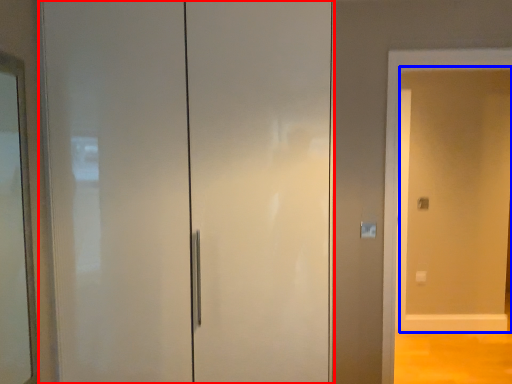
Question: Which object is further to the camera taking this photo, door (highlighted by a red box) or screen door (highlighted by a blue box)?

Choices:
 (A) door
 (B) screen door

Answer: (B)